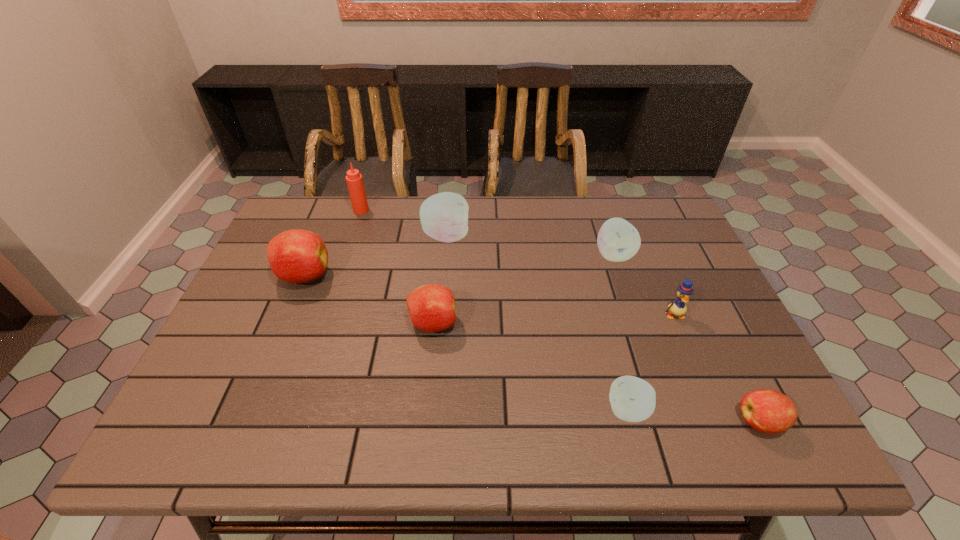
You are a GUI agent. You are given a task and a screenshot of the screen. Output one action in this format:
    pyautogui.click(x=<x>, y=<y>)
    Task: Click on the unoccupied area between the second red apple from right to left and the biggest white apple
    The height and width of the screenshot is (540, 960).
    Given the screenshot: What is the action you would take?
    pyautogui.click(x=440, y=280)

In order to click on vacant region between the second biggest white apple and the nearest red apple in this screenshot , I will do (x=686, y=339).

Image resolution: width=960 pixels, height=540 pixels. Identify the location of empty space between the nearest white apple and the fourth farthest apple. (531, 367).

Identify the location of free spot between the farthest object and the second biggest white apple. click(x=488, y=232).

At what (x,y) coordinates should I click in order to perform the action: click on free area in between the biggest white apple and the nearest white apple. Please return your answer as a coordinate pair (x, y). Image resolution: width=960 pixels, height=540 pixels. Looking at the image, I should click on (537, 323).

Locate an element on the screen. Image resolution: width=960 pixels, height=540 pixels. unoccupied area between the leftmost white apple and the smallest white apple is located at coordinates (537, 323).

Where is `free point between the leftmost white apple and the farthest red apple`? The image size is (960, 540). free point between the leftmost white apple and the farthest red apple is located at coordinates (375, 256).

You are a GUI agent. You are given a task and a screenshot of the screen. Output one action in this format:
    pyautogui.click(x=<x>, y=<y>)
    Task: Click on the free spot between the second smallest white apple and the rightmost red apple
    
    Given the screenshot: What is the action you would take?
    pyautogui.click(x=686, y=339)

Locate an element on the screen. This screenshot has width=960, height=540. free point between the biggest white apple and the smallest white apple is located at coordinates (537, 323).

This screenshot has height=540, width=960. I want to click on vacant area that lies between the leftmost red apple and the biggest white apple, so (375, 256).